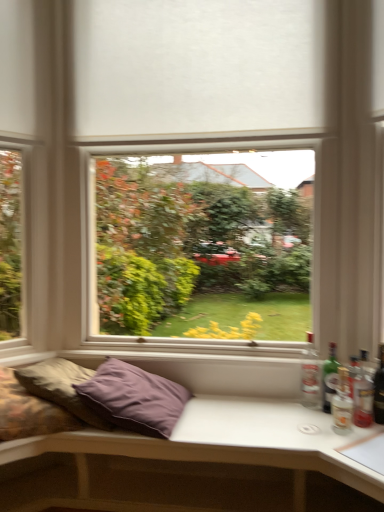
This screenshot has width=384, height=512. Find the location of `free location in front of translucent glass bottle at right, placed as the 3th bottle when sorted from left to right`. free location in front of translucent glass bottle at right, placed as the 3th bottle when sorted from left to right is located at coordinates (364, 441).